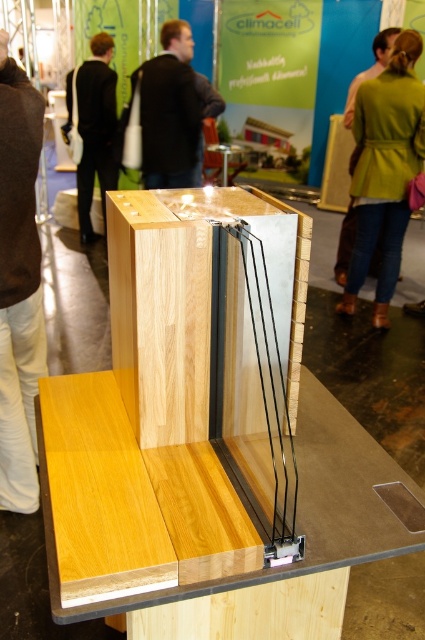
Does point (187, 200) lie behind point (190, 68)?

No, (187, 200) is in front of (190, 68).

This screenshot has width=425, height=640. What do you see at coordinates (186, 301) in the screenshot?
I see `natural wood panel at center` at bounding box center [186, 301].

This screenshot has height=640, width=425. Identify the location of natural wood panel at center. (186, 301).

Can you confirm if light wood table at center is shorter than dark brown leather jacket at upper center?

Yes, light wood table at center is shorter than dark brown leather jacket at upper center.

Can you confirm if light wood table at center is positioned to the left of dark brown leather jacket at upper center?

In fact, light wood table at center is to the right of dark brown leather jacket at upper center.

Who is more distant from viewer, [133,516] or [186,29]?

The point [186,29] is more distant.

Find the location of a particular element. The height and width of the screenshot is (640, 425). light wood table at center is located at coordinates (207, 516).

Is natural wood panel at center bigger than brown wool sweater at lower left?

Incorrect, natural wood panel at center is not larger than brown wool sweater at lower left.

Identify the location of natural wood panel at center. This screenshot has width=425, height=640. (186, 301).

Who is more distant from viewer, (249,204) or (11,84)?

Positioned behind is point (11,84).

What are the coordinates of `natural wood panel at center` in the screenshot? It's located at (186, 301).